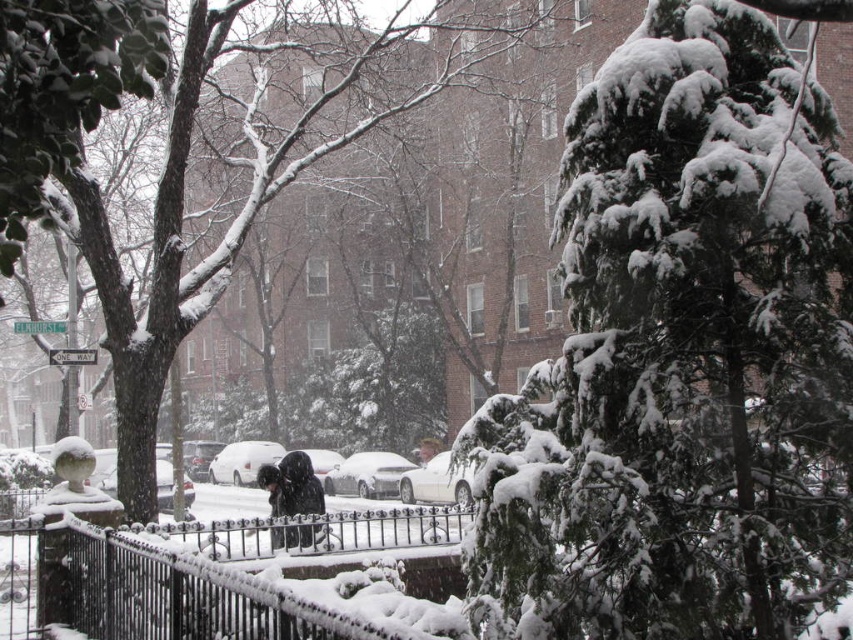
Between snow-covered evergreen at center and black wrought iron fence at center, which one has less height?

Standing shorter between the two is black wrought iron fence at center.

Which is more to the right, snow-covered evergreen at center or black wrought iron fence at center?

snow-covered evergreen at center is more to the right.

At what (x,y) coordinates should I click in order to perform the action: click on snow-covered evergreen at center. Please return your answer as a coordinate pair (x, y). The width and height of the screenshot is (853, 640). Looking at the image, I should click on (683, 355).

Can you confirm if snow-covered evergreen at center is taller than snow-covered wrought iron fence at center?

Indeed, snow-covered evergreen at center has a greater height compared to snow-covered wrought iron fence at center.

Is point (624, 253) behind point (225, 579)?

No, it is not.

Find the location of `snow-covered evergreen at center`. snow-covered evergreen at center is located at coordinates (683, 355).

Does snow-covered evergreen at center come behind dark wool coat at center?

No.

Between snow-covered evergreen at center and dark wool coat at center, which one has less height?

dark wool coat at center

Image resolution: width=853 pixels, height=640 pixels. What do you see at coordinates (683, 355) in the screenshot?
I see `snow-covered evergreen at center` at bounding box center [683, 355].

Identify the location of snow-covered evergreen at center. [x=683, y=355].